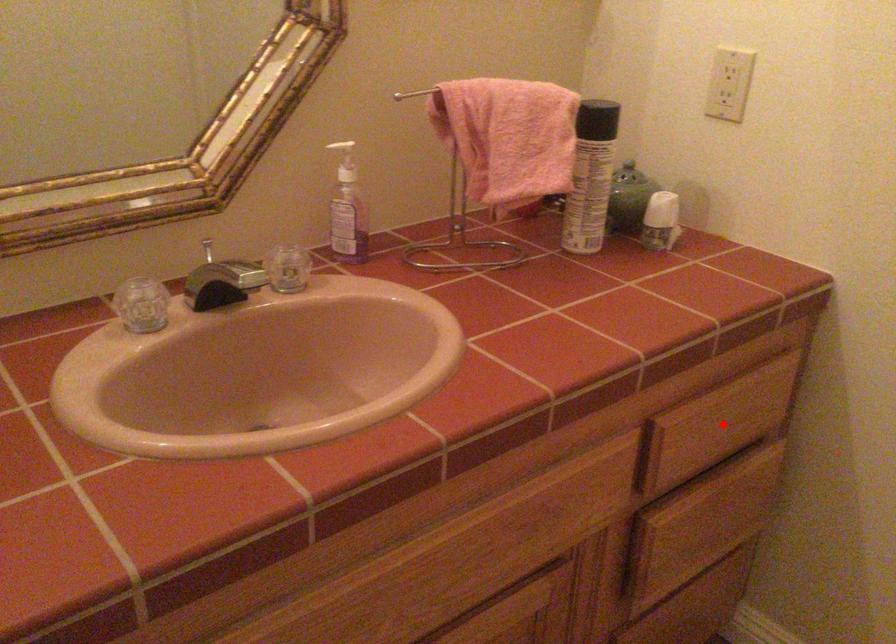
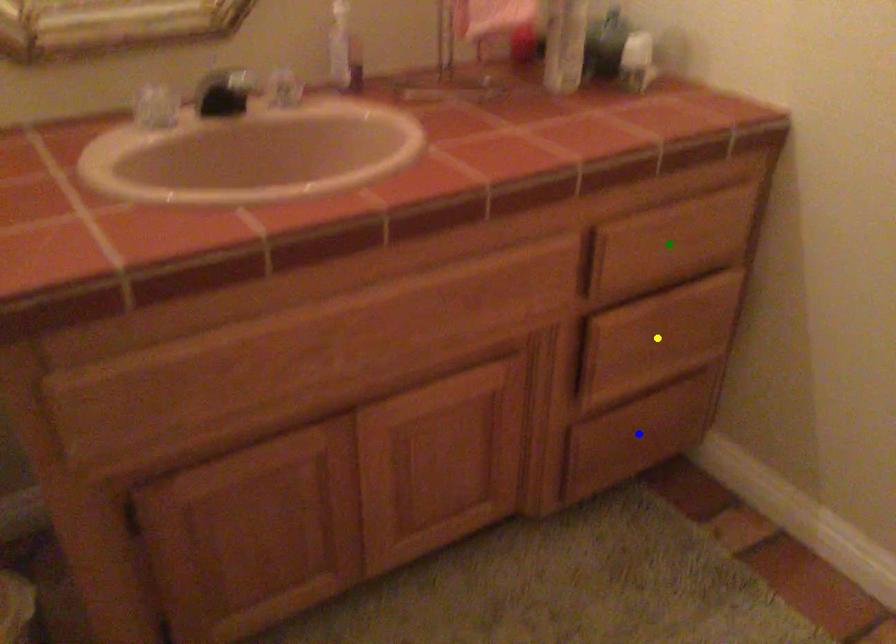
Question: I am providing you with two images of the same scene from different viewpoints. A red point is marked on the first image. You are given multiple points on the second image. In image 2, which mark is for the same physical point as the one in image 1?

Choices:
 (A) green point
 (B) blue point
 (C) yellow point

Answer: (A)